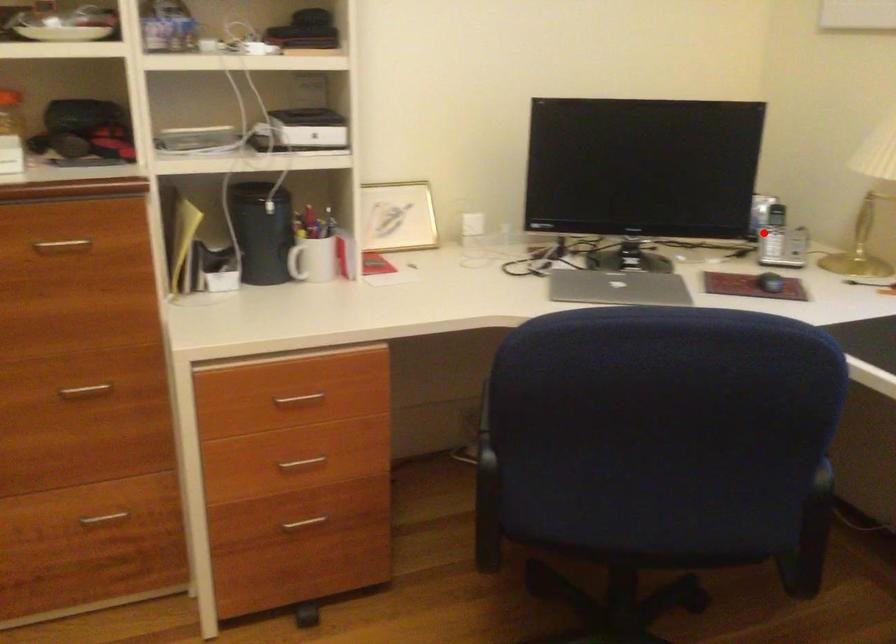
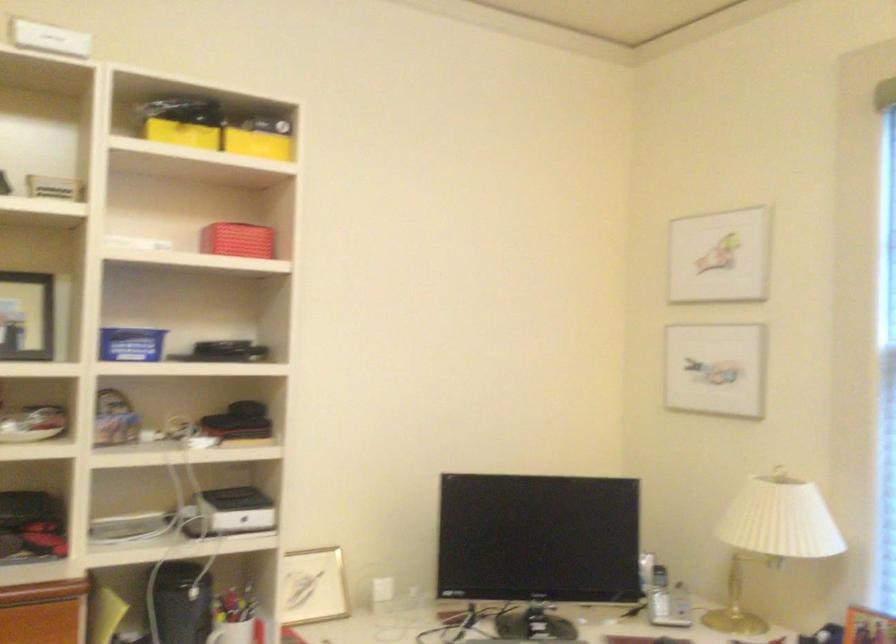
In the second image, find the point that corresponds to the highlighted location in the first image.

(659, 594)